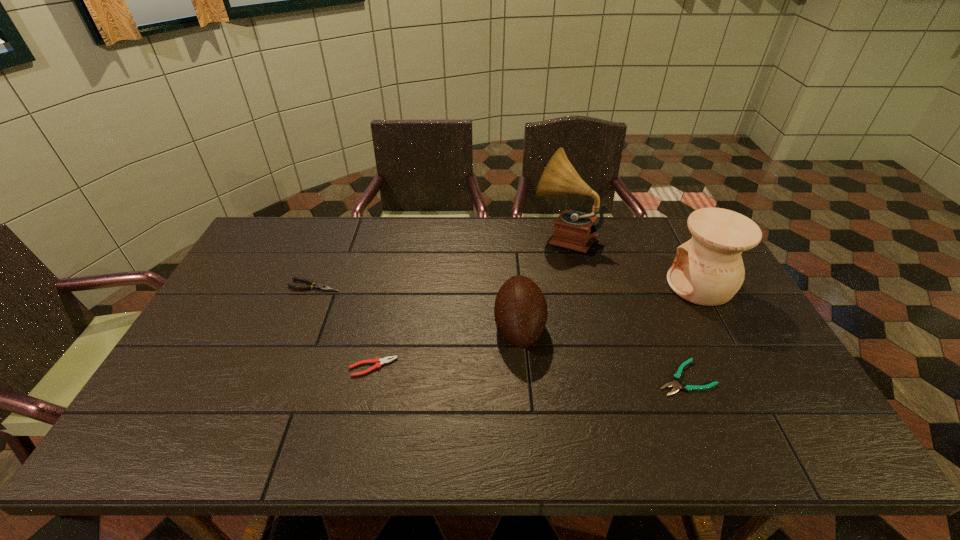
Identify the location of the farthest object. (x=574, y=230).

Where is `phonograph record`? The height and width of the screenshot is (540, 960). phonograph record is located at coordinates (574, 230).

I want to click on the second tallest object, so click(x=708, y=270).

I want to click on the fourth shortest object, so tap(520, 311).

Identify the location of the leftmost pliers. This screenshot has height=540, width=960. (323, 287).

This screenshot has height=540, width=960. Find the location of `the farthest pliers`. the farthest pliers is located at coordinates (323, 287).

Image resolution: width=960 pixels, height=540 pixels. I want to click on the second pliers from right to left, so click(378, 362).

You are a GUI agent. You are given a task and a screenshot of the screen. Output one action in this format:
    pyautogui.click(x=<x>, y=<y>)
    Task: Click on the second shortest object
    The image size is (960, 540).
    Given the screenshot: What is the action you would take?
    pyautogui.click(x=378, y=362)

Identify the location of the shortest object. The height and width of the screenshot is (540, 960). (676, 377).

This screenshot has height=540, width=960. In order to click on the shortest pliers in this screenshot , I will do `click(676, 377)`.